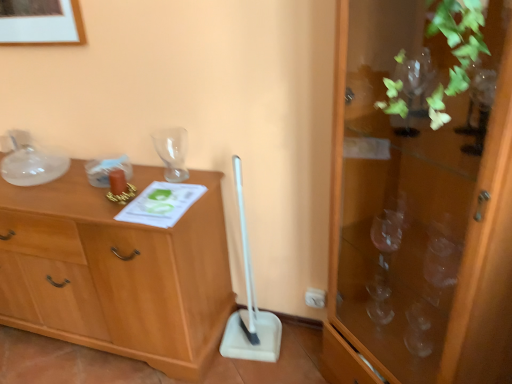
At what (x,y) coordinates should I click in order to perform the action: click on free spot in front of white plastic shovel at center. Please return your answer as a coordinate pair (x, y). This screenshot has width=512, height=384. Looking at the image, I should click on (261, 372).